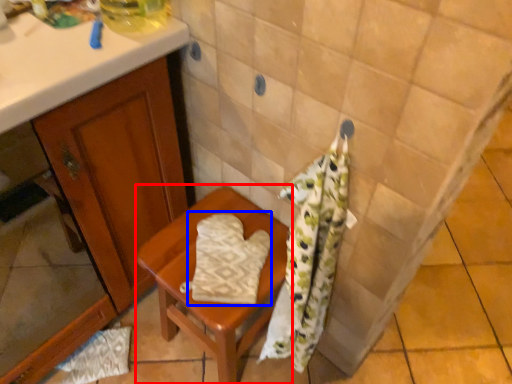
Question: Which object is closer to the camera taking this photo, furniture (highlighted by a red box) or beach towel (highlighted by a blue box)?

Choices:
 (A) furniture
 (B) beach towel

Answer: (A)